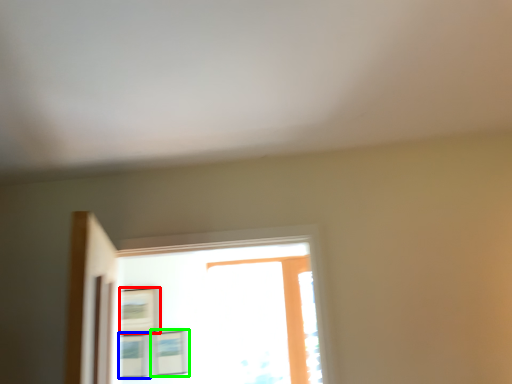
Question: Which object is the closest to the picture frame (highlighted by a red box)? Choose among these: picture frame (highlighted by a blue box) or picture frame (highlighted by a green box).

Choices:
 (A) picture frame
 (B) picture frame

Answer: (A)